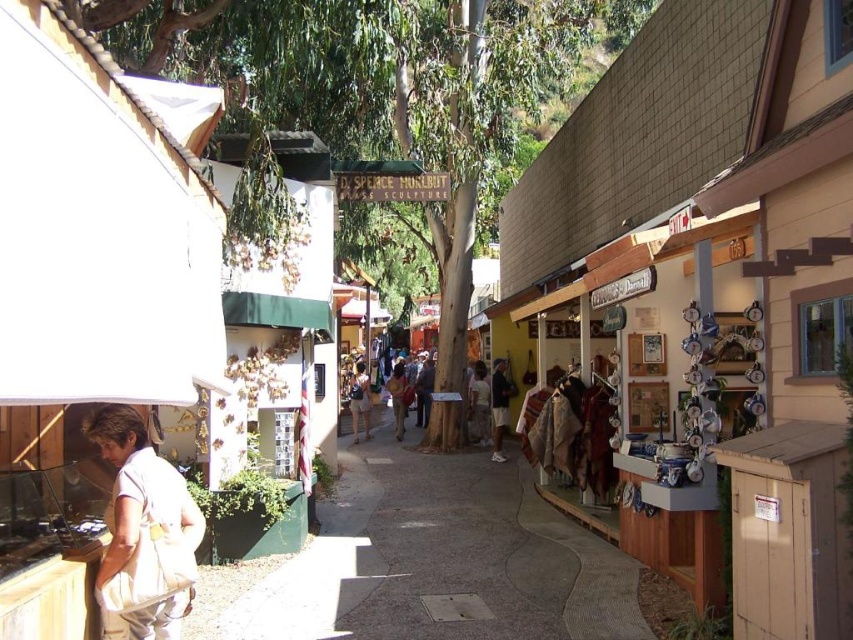
Question: Which of these objects is positioned farthest from the light brown leather jacket at center?

Choices:
 (A) denim shorts at center
 (B) concrete sidewalk at center
 (C) matte black jacket at center
 (D) white cotton shirt at lower left

Answer: (D)

Question: Does concrete sidewalk at center have a greater width compared to dark blue jeans at center?

Choices:
 (A) yes
 (B) no

Answer: (A)

Question: Among these points, which one is farthest from the camera?

Choices:
 (A) (368, 396)
 (B) (506, 384)
 (C) (167, 529)

Answer: (A)

Question: Does white cotton shirt at lower left appear on the left side of denim shorts at center?

Choices:
 (A) no
 (B) yes

Answer: (A)

Question: Which object is farther from the camera taking this photo?

Choices:
 (A) white cotton shirt at lower left
 (B) concrete sidewalk at center
 (C) dark blue jeans at center
 (D) matte black jacket at center

Answer: (D)

Question: Does concrete sidewalk at center appear on the right side of light brown leather jacket at center?

Choices:
 (A) no
 (B) yes

Answer: (A)